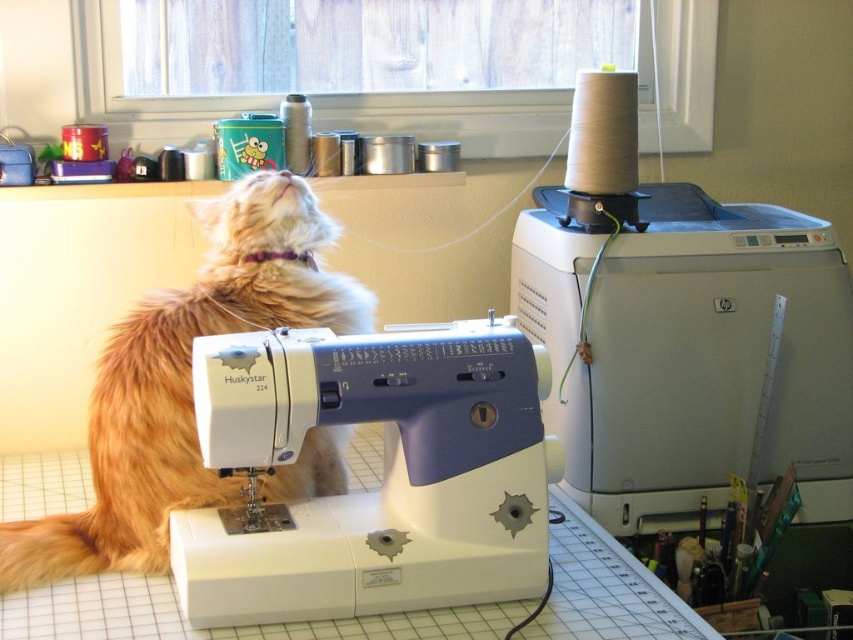
You are a person trying to reach the fluffy orange cat at center from behind the white plastic sewing machine at center. Can you easily reach the cat without moving the sewing machine?

The white plastic sewing machine at center is closer to the viewer than the fluffy orange cat at center, so you can reach the cat without moving the sewing machine because it is behind it.

You are standing at the point marked as point [682,332] in the image. Looking around, you see a white HuskyStar sewing machine with a blue accent on its side and a gray HP printer to its right. Which object is closer to your current position?

The white HuskyStar sewing machine with a blue accent on its side is closer to your current position at point [682,332] because the point is on the sewing machine, which is located to the left of the printer.

You are setting up a new printer in the workspace. The printer needs to be placed at point 0.600 on the x axis. Where should you place the printer relative to the white plastic sewing machine at upper right?

The white plastic sewing machine at upper right is at point 0.520 on the x axis. Since the printer needs to be placed at 0.600 on the x axis, it should be positioned to the right of the white plastic sewing machine at upper right.